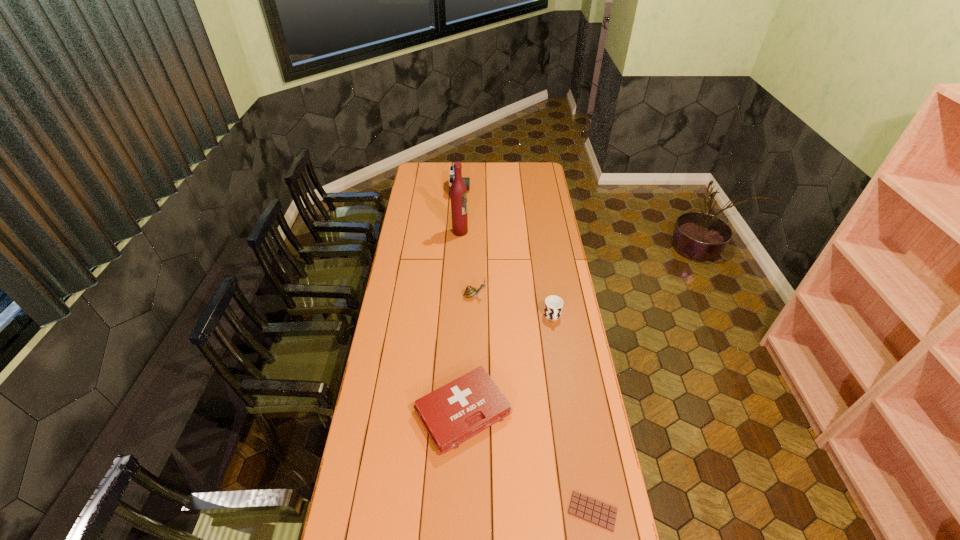
The image size is (960, 540). I want to click on the tallest object, so click(x=458, y=191).

Identify the location of liquor. This screenshot has width=960, height=540. (458, 191).

This screenshot has height=540, width=960. In order to click on the farthest object in this screenshot , I will do `click(466, 180)`.

Locate an element on the screen. The width and height of the screenshot is (960, 540). the fourth nearest object is located at coordinates (470, 291).

The width and height of the screenshot is (960, 540). Find the location of `the third nearest object`. the third nearest object is located at coordinates (553, 306).

The height and width of the screenshot is (540, 960). Identify the location of cup. (553, 306).

You are a GUI agent. You are given a task and a screenshot of the screen. Output one action in this format:
    pyautogui.click(x=<x>, y=<y>)
    Task: Click on the fifth tallest object
    The height and width of the screenshot is (540, 960).
    Given the screenshot: What is the action you would take?
    pyautogui.click(x=457, y=411)

This screenshot has width=960, height=540. I want to click on the first-aid kit, so click(457, 411).

Locate an element on the screen. The image size is (960, 540). the nearest object is located at coordinates (601, 514).

At what (x,y) coordinates should I click in order to perform the action: click on the shortest object. Please return your answer as a coordinate pair (x, y). The height and width of the screenshot is (540, 960). Looking at the image, I should click on (601, 514).